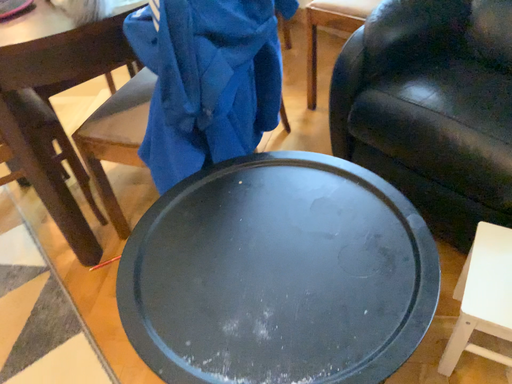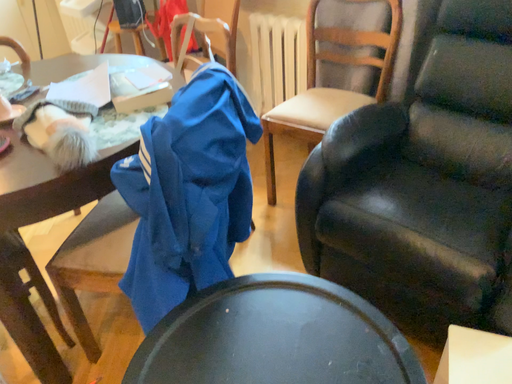
Question: Which way did the camera rotate in the video?

Choices:
 (A) rotated left
 (B) rotated right

Answer: (B)